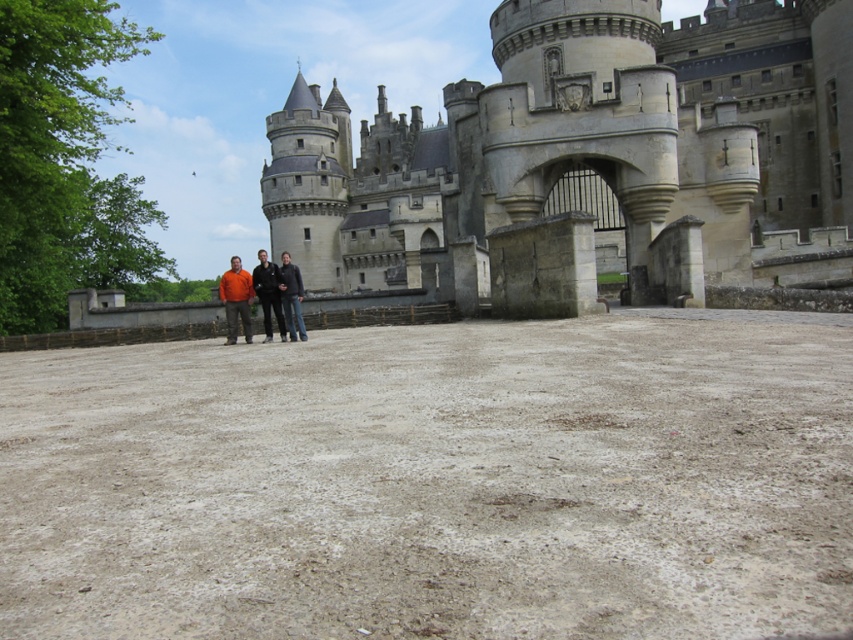
You are a photographer planning to take a group photo of the orange matte shirt at center and the dark blue jeans at center in front of the medieval castle. Considering their heights, which clothing item should be positioned closer to the front to ensure both are fully visible in the photo?

The orange matte shirt at center has a lesser height compared to the dark blue jeans at center, so to ensure both are fully visible, the orange matte shirt at center should be positioned closer to the front.

You are standing at the bottom left corner of the image and want to walk to the orange matte shirt at center. In which direction should you move relative to the castle?

The orange matte shirt at center is located at point coordinates of (x=236, y=300). Since you are at the bottom left corner, you should move towards the right and slightly upwards to reach the orange matte shirt at center.

You are a visitor at the castle and want to take a photo of the gray stone castle at center and the orange fabric jacket at center. Since the castle is so large, will you need to zoom out your camera to include both in the frame?

The gray stone castle at center is larger in size than the orange fabric jacket at center, so you will need to zoom out your camera to include both in the frame.